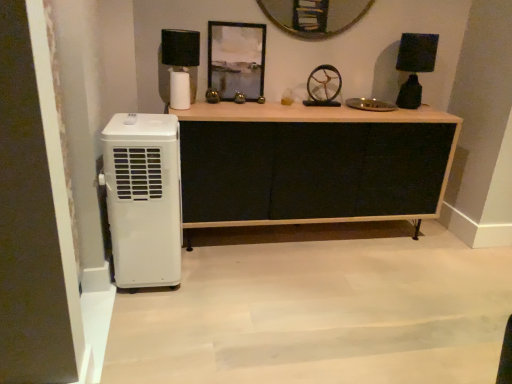
Question: Considering the relative positions of metallic gold wheel at center and black fabric cabinet at center in the image provided, is metallic gold wheel at center to the right of black fabric cabinet at center from the viewer's perspective?

Choices:
 (A) no
 (B) yes

Answer: (B)

Question: Is metallic gold wheel at center with black fabric cabinet at center?

Choices:
 (A) no
 (B) yes

Answer: (A)

Question: From the image's perspective, is metallic gold wheel at center on black fabric cabinet at center?

Choices:
 (A) yes
 (B) no

Answer: (A)

Question: From a real-world perspective, is metallic gold wheel at center on black fabric cabinet at center?

Choices:
 (A) yes
 (B) no

Answer: (A)

Question: Could black fabric cabinet at center be considered to be inside metallic gold wheel at center?

Choices:
 (A) no
 (B) yes

Answer: (A)

Question: Is metallic silver frame at upper center inside or outside of black fabric cabinet at center?

Choices:
 (A) inside
 (B) outside

Answer: (B)

Question: From the image's perspective, is metallic silver frame at upper center above or below black fabric cabinet at center?

Choices:
 (A) above
 (B) below

Answer: (A)

Question: In terms of width, does metallic silver frame at upper center look wider or thinner when compared to black fabric cabinet at center?

Choices:
 (A) thin
 (B) wide

Answer: (A)

Question: Looking at the image, does metallic silver frame at upper center seem bigger or smaller compared to black fabric cabinet at center?

Choices:
 (A) big
 (B) small

Answer: (B)

Question: Is metallic silver frame at upper center inside the boundaries of black matte lampshade at upper left, which appears as the second lamp when viewed from the right, or outside?

Choices:
 (A) inside
 (B) outside

Answer: (B)

Question: From a real-world perspective, is metallic silver frame at upper center physically located above or below black matte lampshade at upper left, which appears as the second lamp when viewed from the right?

Choices:
 (A) below
 (B) above

Answer: (B)

Question: In the image, is metallic silver frame at upper center positioned in front of or behind black matte lampshade at upper left, which appears as the second lamp when viewed from the right?

Choices:
 (A) front
 (B) behind

Answer: (B)

Question: Is metallic silver frame at upper center taller or shorter than black matte lampshade at upper left, which appears as the second lamp when viewed from the right?

Choices:
 (A) short
 (B) tall

Answer: (B)

Question: Looking at the image, does black matte lampshade at upper left, which appears as the second lamp when viewed from the right, seem bigger or smaller compared to black fabric cabinet at center?

Choices:
 (A) big
 (B) small

Answer: (B)

Question: Considering the positions of point (172, 62) and point (367, 168), is point (172, 62) closer or farther from the camera than point (367, 168)?

Choices:
 (A) farther
 (B) closer

Answer: (B)